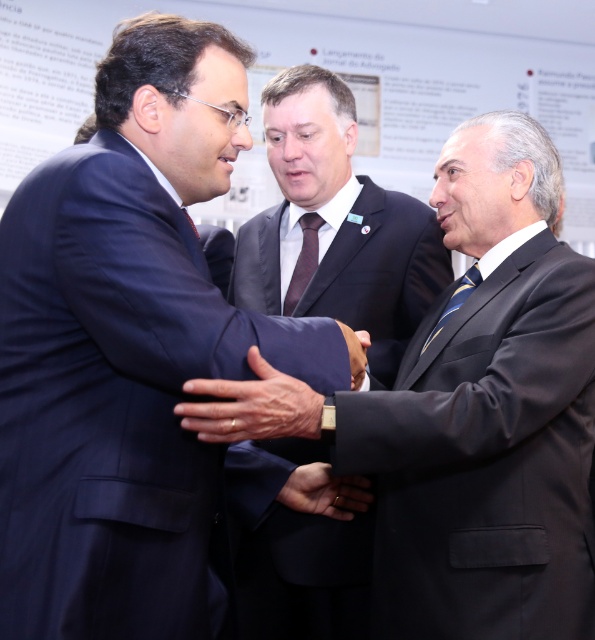
Can you confirm if matte black suit at center is bigger than matte black tie at center?

Yes, matte black suit at center is bigger than matte black tie at center.

Who is positioned more to the left, matte black suit at center or matte black tie at center?

matte black tie at center

Between point (430, 632) and point (195, 234), which one is positioned in front?

Positioned in front is point (195, 234).

Locate an element on the screen. The width and height of the screenshot is (595, 640). matte black suit at center is located at coordinates (468, 413).

Looking at this image, is navy blue suit at center further to the viewer compared to dark brown silk tie at center?

No, it is not.

Can you confirm if navy blue suit at center is positioned above dark brown silk tie at center?

Indeed, navy blue suit at center is positioned over dark brown silk tie at center.

Identify the location of navy blue suit at center. This screenshot has width=595, height=640. coord(293,550).

Is blue striped tie at center thinner than matte black tie at center?

No, blue striped tie at center is not thinner than matte black tie at center.

Consider the image. How much distance is there between blue striped tie at center and matte black tie at center?

A distance of 24.84 inches exists between blue striped tie at center and matte black tie at center.

What are the coordinates of `blue striped tie at center` in the screenshot? It's located at (455, 300).